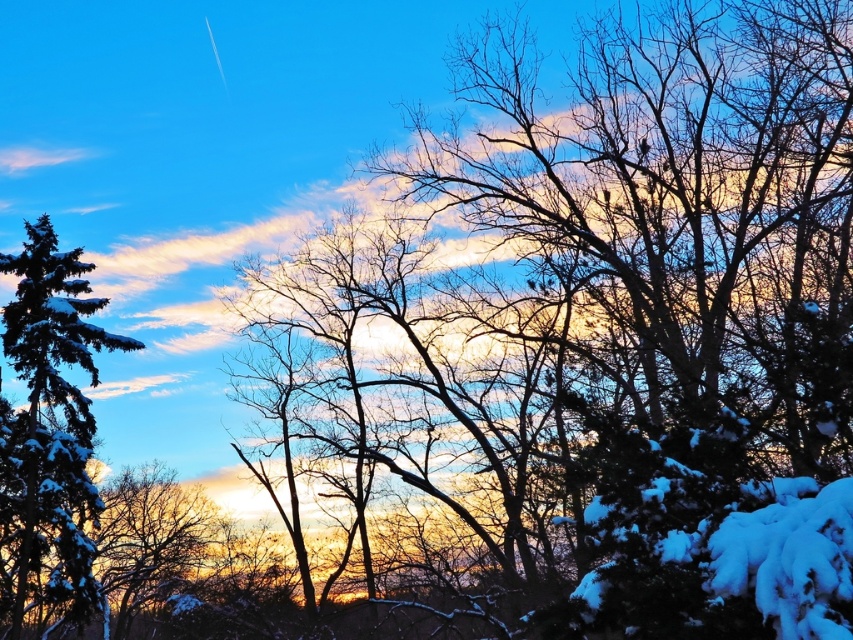
You are standing in the winter scene described. You notice a point marked at coordinates (49,429). Based on the scene description, what object or feature is located at that point?

The point at coordinates (49,429) marks a snow covered evergreen at the left.